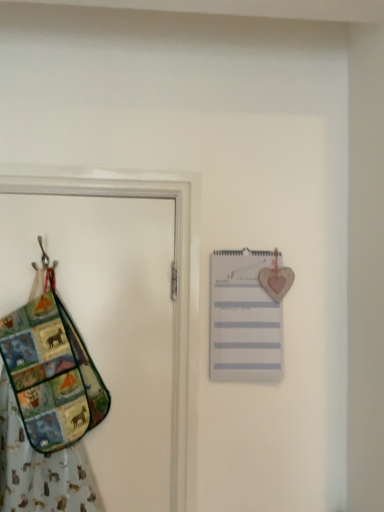
Locate an element on the screen. The image size is (384, 512). multicolored fabric door at left is located at coordinates (108, 326).

This screenshot has height=512, width=384. What do you see at coordinates (244, 318) in the screenshot?
I see `white paper list at upper right` at bounding box center [244, 318].

Locate an element on the screen. The height and width of the screenshot is (512, 384). multicolored fabric door at left is located at coordinates (108, 326).

Does point (156, 281) come behind point (22, 400)?

Yes, point (156, 281) is behind point (22, 400).

Are multicolored fabric door at left and multicolored fabric handbag at left making contact?

They are not placed beside each other.

Which object is positioned more to the right, multicolored fabric door at left or multicolored fabric handbag at left?

multicolored fabric door at left is more to the right.

From a real-world perspective, is multicolored fabric door at left positioned over multicolored fabric handbag at left based on gravity?

Yes.

Does white paper list at upper right contain multicolored fabric door at left?

No.

Which of these two, white paper list at upper right or multicolored fabric door at left, is wider?

Wider between the two is multicolored fabric door at left.

How different are the orientations of white paper list at upper right and multicolored fabric door at left in degrees?

2 degrees.

Is white paper list at upper right positioned with its back to multicolored fabric door at left?

No, white paper list at upper right's orientation is not away from multicolored fabric door at left.

Is multicolored fabric handbag at left at the back of white paper list at upper right?

No, white paper list at upper right's orientation is not away from multicolored fabric handbag at left.

From a real-world perspective, which is physically below, white paper list at upper right or multicolored fabric handbag at left?

multicolored fabric handbag at left is physically lower.

Considering the sizes of objects white paper list at upper right and multicolored fabric handbag at left in the image provided, who is bigger, white paper list at upper right or multicolored fabric handbag at left?

multicolored fabric handbag at left.

The height and width of the screenshot is (512, 384). What are the coordinates of `handbag to the left of white paper list at upper right` in the screenshot? It's located at pos(51,372).

Consider the image. Is the position of multicolored fabric handbag at left less distant than that of white paper list at upper right?

Yes, multicolored fabric handbag at left is closer to the viewer.

From a real-world perspective, is multicolored fabric handbag at left under white paper list at upper right?

Result: Indeed, from a real-world perspective, multicolored fabric handbag at left is positioned beneath white paper list at upper right.

Does point (95, 423) come behind point (215, 304)?

No, it is not.

In the scene shown: From the image's perspective, between multicolored fabric handbag at left and white paper list at upper right, who is located below?

From the image's view, multicolored fabric handbag at left is below.

Is white paper list at upper right at the back of multicolored fabric door at left?

multicolored fabric door at left is not turned away from white paper list at upper right.

Is multicolored fabric door at left wider than white paper list at upper right?

Yes.

Which of these two, multicolored fabric door at left or white paper list at upper right, stands shorter?

With less height is white paper list at upper right.

Is multicolored fabric handbag at left facing away from multicolored fabric door at left?

That's right, multicolored fabric handbag at left is facing away from multicolored fabric door at left.

Based on their sizes in the image, would you say multicolored fabric handbag at left is bigger or smaller than multicolored fabric door at left?

multicolored fabric handbag at left is smaller than multicolored fabric door at left.

This screenshot has width=384, height=512. Find the location of `door behind the multicolored fabric handbag at left`. door behind the multicolored fabric handbag at left is located at coordinates (108, 326).

In the image, there is a multicolored fabric handbag at left. Where is `door above it (from the image's perspective)`? The height and width of the screenshot is (512, 384). door above it (from the image's perspective) is located at coordinates (108, 326).

In order to click on door lying below the white paper list at upper right (from the image's perspective) in this screenshot , I will do `click(108, 326)`.

Which object lies nearer to the anchor point multicolored fabric handbag at left, white paper list at upper right or multicolored fabric door at left?

multicolored fabric door at left lies closer to multicolored fabric handbag at left than the other object.

Based on their spatial positions, is white paper list at upper right or multicolored fabric handbag at left closer to multicolored fabric door at left?

Based on the image, multicolored fabric handbag at left appears to be nearer to multicolored fabric door at left.

From the image, which object appears to be farther from white paper list at upper right, multicolored fabric door at left or multicolored fabric handbag at left?

multicolored fabric handbag at left is positioned further to the anchor white paper list at upper right.

In the scene shown: Based on their spatial positions, is multicolored fabric door at left or white paper list at upper right further from multicolored fabric handbag at left?

white paper list at upper right.

Which object lies further to the anchor point multicolored fabric door at left, multicolored fabric handbag at left or white paper list at upper right?

white paper list at upper right lies further to multicolored fabric door at left than the other object.

Based on their spatial positions, is multicolored fabric handbag at left or multicolored fabric door at left further from white paper list at upper right?

multicolored fabric handbag at left is further to white paper list at upper right.

Image resolution: width=384 pixels, height=512 pixels. What are the coordinates of `door located between multicolored fabric handbag at left and white paper list at upper right in the left-right direction` in the screenshot? It's located at (108, 326).